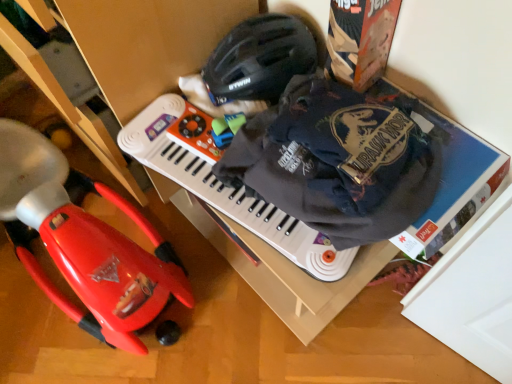
Question: From a real-world perspective, is dark blue cotton t-shirt at upper right on top of red plastic toy car at left?

Choices:
 (A) no
 (B) yes

Answer: (B)

Question: Is dark blue cotton t-shirt at upper right positioned behind red plastic toy car at left?

Choices:
 (A) yes
 (B) no

Answer: (B)

Question: Can you confirm if dark blue cotton t-shirt at upper right is positioned to the right of red plastic toy car at left?

Choices:
 (A) yes
 (B) no

Answer: (A)

Question: Does dark blue cotton t-shirt at upper right lie in front of red plastic toy car at left?

Choices:
 (A) yes
 (B) no

Answer: (A)

Question: Can you confirm if dark blue cotton t-shirt at upper right is shorter than red plastic toy car at left?

Choices:
 (A) yes
 (B) no

Answer: (A)

Question: Based on their sizes in the image, would you say white plastic musical keyboard at center is bigger or smaller than black matte helmet at upper center?

Choices:
 (A) big
 (B) small

Answer: (B)

Question: From a real-world perspective, is white plastic musical keyboard at center physically located above or below black matte helmet at upper center?

Choices:
 (A) above
 (B) below

Answer: (B)

Question: Considering the positions of white plastic musical keyboard at center and black matte helmet at upper center in the image, is white plastic musical keyboard at center wider or thinner than black matte helmet at upper center?

Choices:
 (A) thin
 (B) wide

Answer: (A)

Question: Is white plastic musical keyboard at center taller or shorter than black matte helmet at upper center?

Choices:
 (A) short
 (B) tall

Answer: (A)

Question: Is dark blue cotton t-shirt at upper right inside or outside of white plastic musical keyboard at center?

Choices:
 (A) inside
 (B) outside

Answer: (B)

Question: Is dark blue cotton t-shirt at upper right in front of or behind white plastic musical keyboard at center in the image?

Choices:
 (A) front
 (B) behind

Answer: (A)

Question: From a real-world perspective, is dark blue cotton t-shirt at upper right positioned above or below white plastic musical keyboard at center?

Choices:
 (A) below
 (B) above

Answer: (B)

Question: From the image's perspective, is dark blue cotton t-shirt at upper right positioned above or below white plastic musical keyboard at center?

Choices:
 (A) below
 (B) above

Answer: (B)

Question: Does point (322, 249) appear closer or farther from the camera than point (2, 215)?

Choices:
 (A) closer
 (B) farther

Answer: (A)

Question: Is white plastic musical keyboard at center to the left or to the right of red plastic toy car at left in the image?

Choices:
 (A) left
 (B) right

Answer: (B)